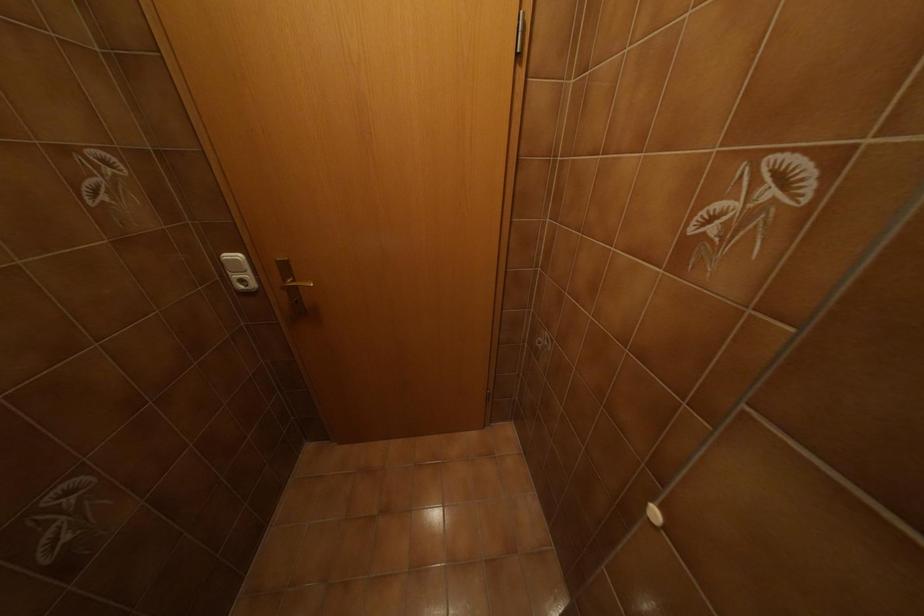
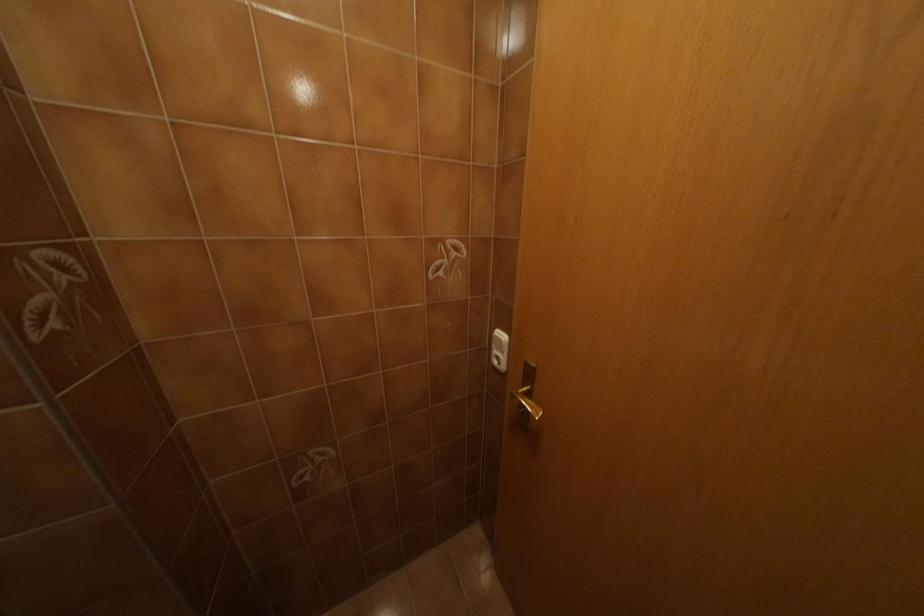
Question: The first image is from the beginning of the video and the second image is from the end. How did the camera likely rotate when shooting the video?

Choices:
 (A) Left
 (B) Right
 (C) Up
 (D) Down

Answer: (A)